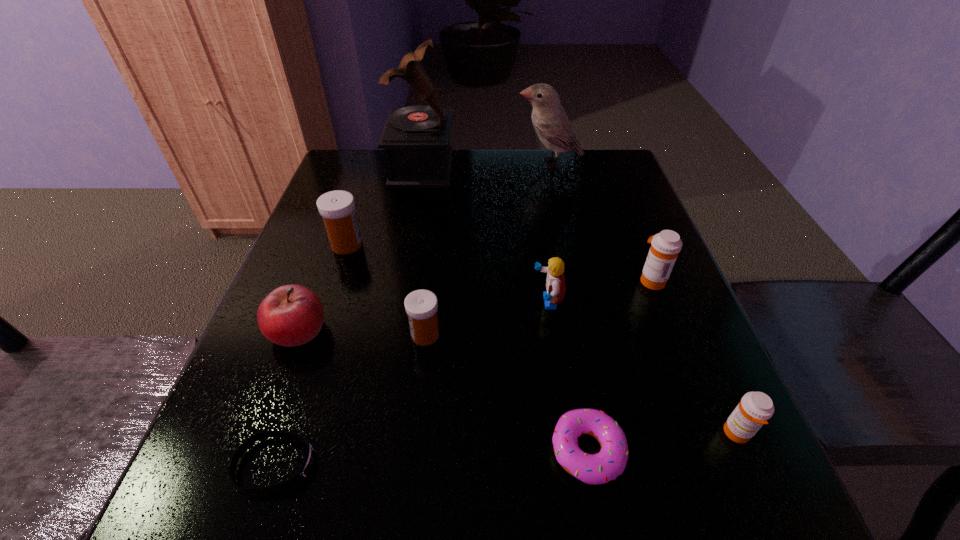
You are a GUI agent. You are given a task and a screenshot of the screen. Output one action in this format:
    pyautogui.click(x=<x>, y=<y>)
    Task: Click on the free space between the second medicine from left to right and the shortest object
    The image size is (960, 540).
    Given the screenshot: What is the action you would take?
    pyautogui.click(x=350, y=400)

Where is `free spot between the nearest medicine and the wristband`? free spot between the nearest medicine and the wristband is located at coordinates (507, 449).

The width and height of the screenshot is (960, 540). Identify the location of free space that is in between the tallest object and the Lego. (485, 235).

Where is `vacant point located between the leftmost medicine and the apple`? This screenshot has height=540, width=960. vacant point located between the leftmost medicine and the apple is located at coordinates (323, 287).

Find the location of `free spot between the farther white medicine and the bird`. free spot between the farther white medicine and the bird is located at coordinates (448, 204).

This screenshot has height=540, width=960. Identify the location of free spot between the Lego and the farther orange medicine. (599, 291).

Image resolution: width=960 pixels, height=540 pixels. In order to click on free spot between the nearer orange medicine and the shortest object in this screenshot , I will do `click(507, 449)`.

At what (x,y) coordinates should I click in order to perform the action: click on vacant space that's between the Lego and the pink doughnut. Please return your answer as a coordinate pair (x, y). This screenshot has width=960, height=540. Looking at the image, I should click on (567, 376).

Find the location of `the closest object to the bigger white medicine`. the closest object to the bigger white medicine is located at coordinates (291, 315).

The height and width of the screenshot is (540, 960). Find the location of `object that is the fifth nearest to the apple`. object that is the fifth nearest to the apple is located at coordinates (610, 462).